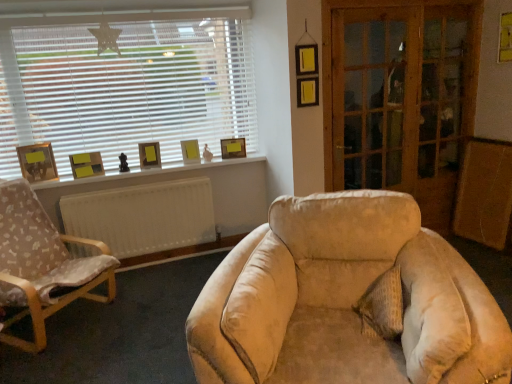
Question: Can you confirm if wooden screen door at right, acting as the second screen door starting from the left, is thinner than yellow matte picture frame at upper center, marked as the fifth picture frame in a left-to-right arrangement?

Choices:
 (A) yes
 (B) no

Answer: (A)

Question: Is wooden screen door at right, acting as the second screen door starting from the left, not within yellow matte picture frame at upper center, marked as the fifth picture frame in a left-to-right arrangement?

Choices:
 (A) yes
 (B) no

Answer: (A)

Question: From the image's perspective, is wooden screen door at right, placed as the 1th screen door when sorted from right to left, located above yellow matte picture frame at upper center, which is counted as the first picture frame, starting from the right?

Choices:
 (A) no
 (B) yes

Answer: (B)

Question: From the image's perspective, is wooden screen door at right, acting as the second screen door starting from the left, under yellow matte picture frame at upper center, which is counted as the first picture frame, starting from the right?

Choices:
 (A) no
 (B) yes

Answer: (A)

Question: Would you say wooden screen door at right, placed as the 1th screen door when sorted from right to left, is a long distance from yellow matte picture frame at upper center, which is counted as the first picture frame, starting from the right?

Choices:
 (A) yes
 (B) no

Answer: (A)

Question: Does wooden screen door at right, acting as the second screen door starting from the left, have a greater height compared to yellow matte picture frame at upper center, which is counted as the first picture frame, starting from the right?

Choices:
 (A) yes
 (B) no

Answer: (A)

Question: From a real-world perspective, does textured beige pillow at center stand above matte wooden picture frame at left, the fifth picture frame from the right?

Choices:
 (A) no
 (B) yes

Answer: (A)

Question: Does textured beige pillow at center contain matte wooden picture frame at left, the first picture frame when ordered from left to right?

Choices:
 (A) yes
 (B) no

Answer: (B)

Question: Does textured beige pillow at center have a larger size compared to matte wooden picture frame at left, the fifth picture frame from the right?

Choices:
 (A) no
 (B) yes

Answer: (B)

Question: Does textured beige pillow at center have a lesser width compared to matte wooden picture frame at left, the fifth picture frame from the right?

Choices:
 (A) no
 (B) yes

Answer: (A)

Question: Does textured beige pillow at center have a greater height compared to matte wooden picture frame at left, the fifth picture frame from the right?

Choices:
 (A) yes
 (B) no

Answer: (B)

Question: Is textured beige pillow at center facing away from matte wooden picture frame at left, the first picture frame when ordered from left to right?

Choices:
 (A) no
 (B) yes

Answer: (A)

Question: Is wooden screen door at right, acting as the second screen door starting from the left, at the right side of yellow paper at upper right?

Choices:
 (A) no
 (B) yes

Answer: (A)